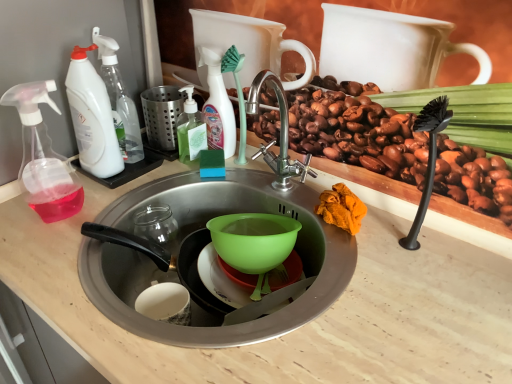
Question: Does white plastic spray bottle at left, the 2th cleaning product in the right-to-left sequence, have a lesser width compared to translucent plastic spray bottle at upper center, the third cleaning product positioned from the left?

Choices:
 (A) yes
 (B) no

Answer: (B)

Question: Can you confirm if white plastic spray bottle at left, placed as the 2th cleaning product when sorted from left to right, is positioned to the right of translucent plastic spray bottle at upper center, which is counted as the 1th cleaning product, starting from the right?

Choices:
 (A) no
 (B) yes

Answer: (A)

Question: Can you confirm if white plastic spray bottle at left, placed as the 2th cleaning product when sorted from left to right, is wider than translucent plastic spray bottle at upper center, the third cleaning product positioned from the left?

Choices:
 (A) no
 (B) yes

Answer: (B)

Question: Considering the relative sizes of white plastic spray bottle at left, the 2th cleaning product in the right-to-left sequence, and translucent plastic spray bottle at upper center, the third cleaning product positioned from the left, in the image provided, is white plastic spray bottle at left, the 2th cleaning product in the right-to-left sequence, shorter than translucent plastic spray bottle at upper center, the third cleaning product positioned from the left,?

Choices:
 (A) yes
 (B) no

Answer: (B)

Question: Is translucent plastic spray bottle at upper center, the third cleaning product positioned from the left, inside white plastic spray bottle at left, the 2th cleaning product in the right-to-left sequence?

Choices:
 (A) yes
 (B) no

Answer: (B)

Question: Is green translucent soap dispenser at center situated inside transparent plastic soap dispenser at left or outside?

Choices:
 (A) inside
 (B) outside

Answer: (B)

Question: From a real-world perspective, is green translucent soap dispenser at center above or below transparent plastic soap dispenser at left?

Choices:
 (A) above
 (B) below

Answer: (B)

Question: Is green translucent soap dispenser at center wider or thinner than transparent plastic soap dispenser at left?

Choices:
 (A) thin
 (B) wide

Answer: (A)

Question: In terms of size, does green translucent soap dispenser at center appear bigger or smaller than transparent plastic soap dispenser at left?

Choices:
 (A) big
 (B) small

Answer: (B)

Question: Considering the positions of point (98, 139) and point (193, 104), is point (98, 139) closer or farther from the camera than point (193, 104)?

Choices:
 (A) closer
 (B) farther

Answer: (A)

Question: Looking at the image, does white plastic spray bottle at left, which is the 1th cleaning product from left to right, seem bigger or smaller compared to green translucent soap dispenser at center?

Choices:
 (A) big
 (B) small

Answer: (A)

Question: From the image's perspective, is white plastic spray bottle at left, which is the 1th cleaning product from left to right, located above or below green translucent soap dispenser at center?

Choices:
 (A) below
 (B) above

Answer: (B)

Question: From a real-world perspective, relative to green translucent soap dispenser at center, is white plastic spray bottle at left, which is the 1th cleaning product from left to right, vertically above or below?

Choices:
 (A) below
 (B) above

Answer: (B)

Question: Visually, is green translucent soap dispenser at center positioned to the left or to the right of translucent plastic spray bottle at upper center, which is counted as the 1th cleaning product, starting from the right?

Choices:
 (A) left
 (B) right

Answer: (A)

Question: Is green translucent soap dispenser at center spatially inside translucent plastic spray bottle at upper center, the third cleaning product positioned from the left, or outside of it?

Choices:
 (A) outside
 (B) inside

Answer: (A)